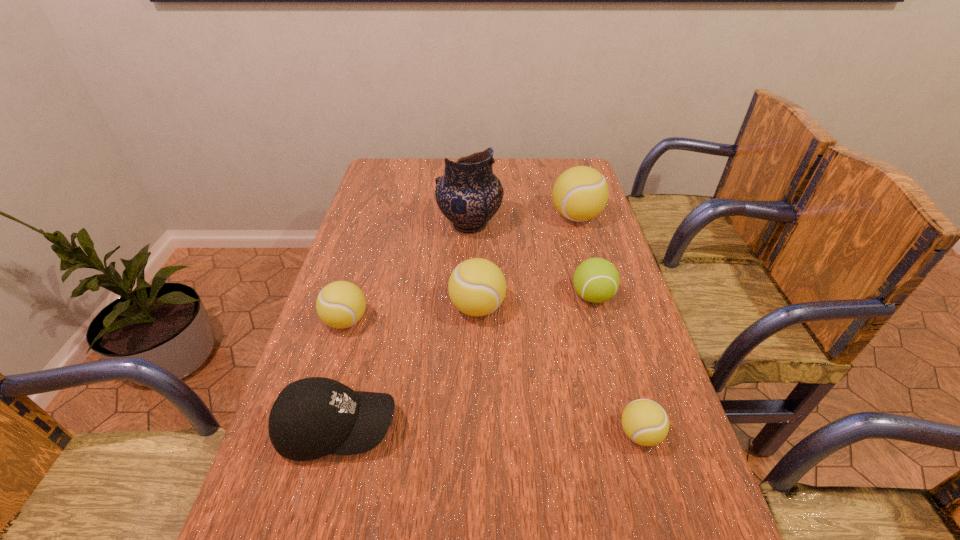
Locate an element on the screen. the shortest object is located at coordinates (645, 422).

You are a GUI agent. You are given a task and a screenshot of the screen. Output one action in this format:
    pyautogui.click(x=<x>, y=<y>)
    Task: Click on the smallest yellow tennis ball
    This screenshot has height=540, width=960.
    Given the screenshot: What is the action you would take?
    pyautogui.click(x=645, y=422)

The height and width of the screenshot is (540, 960). Find the location of `vacant space situated on the front of the pottery`. vacant space situated on the front of the pottery is located at coordinates (468, 303).

The image size is (960, 540). Identify the location of vacant space located on the back of the biggest yellow tennis ball. (561, 163).

I want to click on free space located on the left of the second yellow tennis ball from left to right, so click(326, 308).

Find the location of `free space located on the front-facing side of the baseball cap`. free space located on the front-facing side of the baseball cap is located at coordinates (546, 428).

Locate an element on the screen. Image resolution: width=960 pixels, height=540 pixels. vacant area located 0.330m on the right of the leftmost yellow tennis ball is located at coordinates (496, 321).

Locate an element on the screen. The image size is (960, 540). vacant position located 0.220m on the left of the green tennis ball is located at coordinates (491, 296).

Locate an element on the screen. This screenshot has width=960, height=540. vacant space located on the left of the nearest tennis ball is located at coordinates (444, 434).

Find the location of a particular element. baseball cap situated at the left edge is located at coordinates (313, 417).